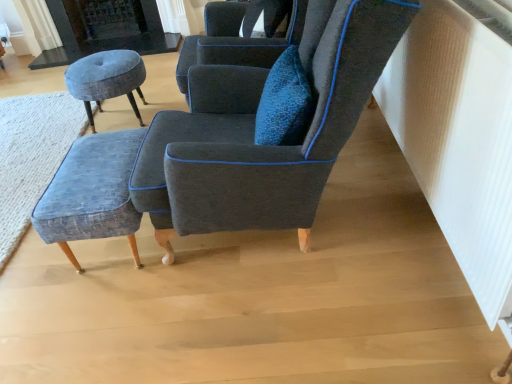
Question: Considering the relative sizes of velvet blue stool at left, the second stool from the bottom, and velvet blue ottoman at lower left in the image provided, is velvet blue stool at left, the second stool from the bottom, bigger than velvet blue ottoman at lower left?

Choices:
 (A) yes
 (B) no

Answer: (B)

Question: Are velvet blue stool at left, the second stool from the bottom, and velvet blue ottoman at lower left located far from each other?

Choices:
 (A) no
 (B) yes

Answer: (A)

Question: From a real-world perspective, is velvet blue stool at left, the second stool from the bottom, located higher than velvet blue ottoman at lower left?

Choices:
 (A) yes
 (B) no

Answer: (A)

Question: From the image's perspective, is velvet blue stool at left, placed as the first stool when sorted from top to bottom, beneath velvet blue ottoman at lower left?

Choices:
 (A) yes
 (B) no

Answer: (B)

Question: Is velvet blue stool at left, placed as the first stool when sorted from top to bottom, positioned with its back to velvet blue ottoman at lower left?

Choices:
 (A) no
 (B) yes

Answer: (A)

Question: Would you say black stone fireplace at upper left is inside or outside velvet blue stool at left, the second stool from the bottom?

Choices:
 (A) inside
 (B) outside

Answer: (B)

Question: Is point (87, 3) closer or farther from the camera than point (117, 67)?

Choices:
 (A) closer
 (B) farther

Answer: (B)

Question: From the image's perspective, is black stone fireplace at upper left positioned above or below velvet blue stool at left, the 1th stool in the back-to-front sequence?

Choices:
 (A) below
 (B) above

Answer: (B)

Question: In the image, is black stone fireplace at upper left positioned in front of or behind velvet blue stool at left, the second stool from the bottom?

Choices:
 (A) front
 (B) behind

Answer: (B)

Question: Is point (219, 23) positioned closer to the camera than point (62, 18)?

Choices:
 (A) farther
 (B) closer

Answer: (B)

Question: Do you think velvet dark blue armchair at center, placed as the 2th chair when sorted from front to back, is within black stone fireplace at upper left, or outside of it?

Choices:
 (A) outside
 (B) inside

Answer: (A)

Question: Is velvet dark blue armchair at center, placed as the 2th chair when sorted from front to back, taller or shorter than black stone fireplace at upper left?

Choices:
 (A) tall
 (B) short

Answer: (A)

Question: From a real-world perspective, is velvet dark blue armchair at center, placed as the 2th chair when sorted from front to back, above or below black stone fireplace at upper left?

Choices:
 (A) below
 (B) above

Answer: (B)

Question: From the image's perspective, is velvet dark blue armchair at center, which is counted as the first chair, starting from the back, positioned above or below velvet blue armchair at center, placed as the second chair when sorted from back to front?

Choices:
 (A) above
 (B) below

Answer: (A)

Question: Would you say velvet dark blue armchair at center, which is counted as the first chair, starting from the back, is inside or outside velvet blue armchair at center, which is the first chair from front to back?

Choices:
 (A) outside
 (B) inside

Answer: (A)